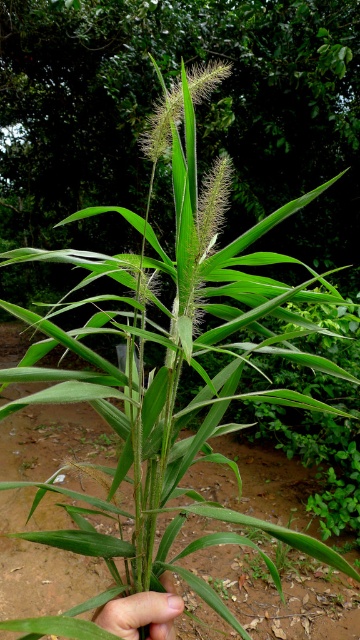
You are a botanist examining a plant in a forest. You see a green leafy plant at center represented by point (196,113). Based on the coordinates, is the plant closer to the top or bottom of the image?

The green leafy plant at center represented by point (196,113) has a y coordinate of 0.547, which is closer to the top of the image since 0.547 is above the midpoint of 0.5.

You are a gardener who wants to plant a new flower that requires a minimum of 3 meters of space between it and the green leafy plant at center. Can you plant the flower near the brown soil at center?

The green leafy plant at center is 4.50 meters from brown soil at center. Since the required minimum distance is 3 meters, the flower can be planted near the brown soil at center as the distance is sufficient.

You are a botanist examining a plant specimen. You notice the green leafy plant at center and the brown soil at center. Which object is closer to your eyes?

The green leafy plant at center is closer to the viewer than the brown soil at center.